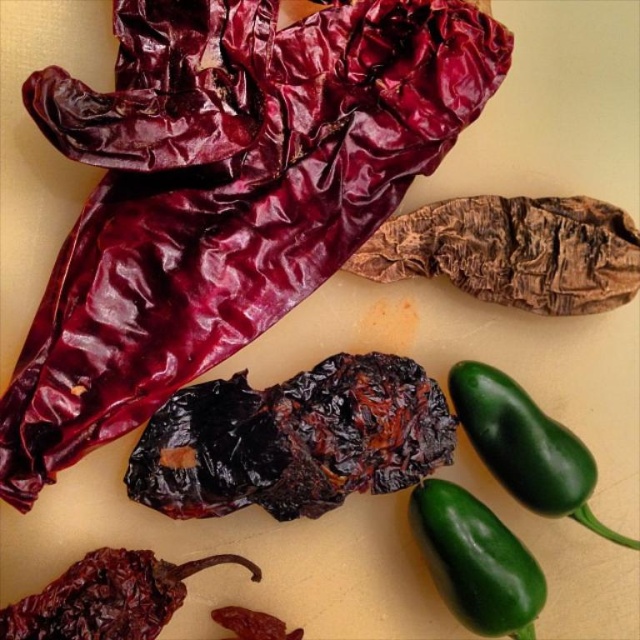
Question: Which point is closer to the camera taking this photo?

Choices:
 (A) (493, 474)
 (B) (332, 499)
 (C) (160, 616)

Answer: (C)

Question: Which object is the closest to the green glossy jalapeño at lower right?

Choices:
 (A) brown leathery pepper at center
 (B) green glossy jalapeño at lower center
 (C) dried red pepper at lower left
 (D) charcoal black dried chili pepper at center

Answer: (B)

Question: Considering the real-world distances, which object is closest to the green glossy jalapeño at lower right?

Choices:
 (A) charcoal black dried chili pepper at center
 (B) green glossy jalapeño at lower center

Answer: (B)

Question: Is brown leathery pepper at center bigger than green glossy jalapeño at lower center?

Choices:
 (A) yes
 (B) no

Answer: (A)

Question: Where is green glossy jalapeño at lower right located in relation to green glossy jalapeño at lower center in the image?

Choices:
 (A) right
 (B) left

Answer: (A)

Question: Does charcoal black dried chili pepper at center have a larger size compared to dried red pepper at lower left?

Choices:
 (A) yes
 (B) no

Answer: (A)